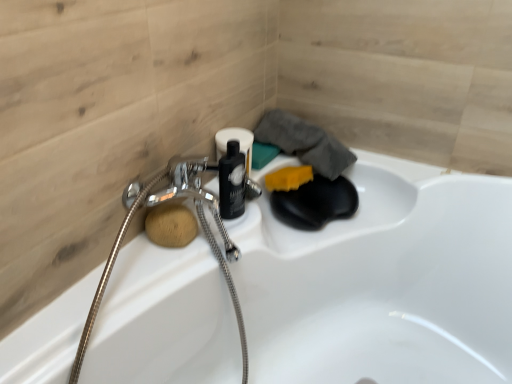
Question: Do you think wooden sponge at lower left, marked as the first soap in a left-to-right arrangement, is within metallic silver garden hose at left, or outside of it?

Choices:
 (A) outside
 (B) inside

Answer: (B)

Question: Is wooden sponge at lower left, which ranks as the 2th soap in back-to-front order, wider or thinner than metallic silver garden hose at left?

Choices:
 (A) wide
 (B) thin

Answer: (B)

Question: Estimate the real-world distances between objects in this image. Which object is closer to the wooden sponge at lower left, which ranks as the second soap in right-to-left order?

Choices:
 (A) yellow sponge at upper right, the second soap in the bottom-to-top sequence
 (B) metallic silver garden hose at left

Answer: (B)

Question: Which object is the closest to the wooden sponge at lower left, which is the 1th soap in bottom-to-top order?

Choices:
 (A) yellow sponge at upper right, the second soap in the bottom-to-top sequence
 (B) metallic silver garden hose at left

Answer: (B)